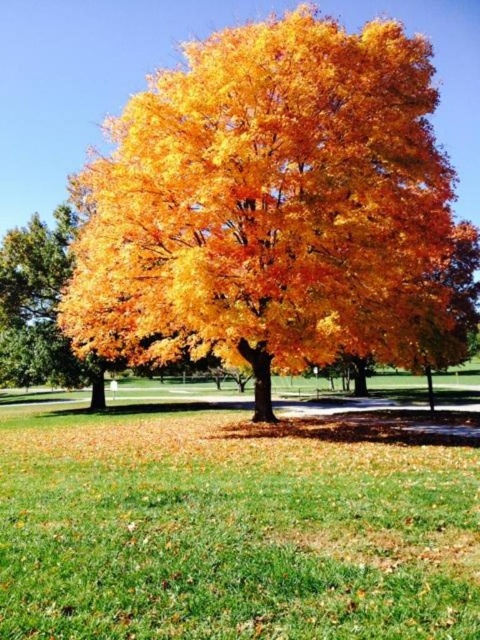
Question: Can you confirm if golden yellow leaves at center is positioned to the left of green grass at center?

Choices:
 (A) no
 (B) yes

Answer: (B)

Question: Does golden yellow leaves at center appear under green grass at center?

Choices:
 (A) yes
 (B) no

Answer: (B)

Question: Is golden yellow leaves at center below green grass at center?

Choices:
 (A) yes
 (B) no

Answer: (B)